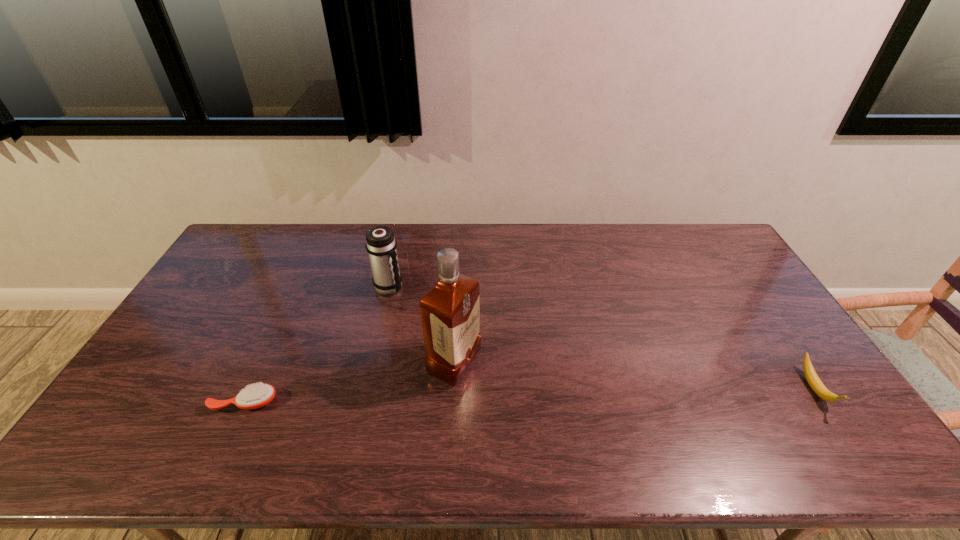
Locate an element on the screen. the shortest object is located at coordinates (255, 396).

The width and height of the screenshot is (960, 540). I want to click on hairbrush, so click(255, 396).

Find the location of `banana`. banana is located at coordinates (815, 383).

Identify the location of the rightmost object. This screenshot has height=540, width=960. (815, 383).

Identify the location of liquor. (450, 311).

I want to click on the third object from left to right, so click(x=450, y=311).

Locate an element on the screen. The height and width of the screenshot is (540, 960). the farthest object is located at coordinates (381, 245).

You are a GUI agent. You are given a task and a screenshot of the screen. Output one action in this format:
    pyautogui.click(x=<x>, y=<y>)
    Task: Click on the thermos bottle
    The width and height of the screenshot is (960, 540).
    Given the screenshot: What is the action you would take?
    pyautogui.click(x=381, y=245)

Locate an element on the screen. This screenshot has width=960, height=540. vacant space situated on the right of the shortest object is located at coordinates (330, 402).

At what (x,y) coordinates should I click in order to perform the action: click on vacant space located on the front label of the tallest object. Please return your answer as a coordinate pair (x, y). This screenshot has width=960, height=540. Looking at the image, I should click on (531, 400).